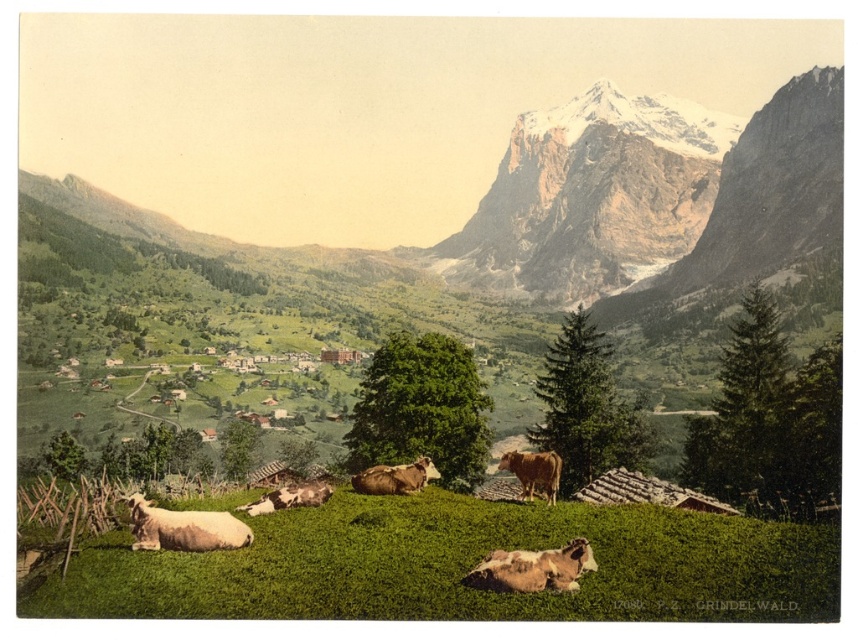
Question: Which of the following is the farthest from the observer?

Choices:
 (A) spotted fur cow at center
 (B) brown furry cow at center
 (C) brown speckled cow at lower center

Answer: (B)

Question: Is white woolly sheep at lower left to the right of brown furry cow at center from the viewer's perspective?

Choices:
 (A) no
 (B) yes

Answer: (A)

Question: Observing the image, what is the correct spatial positioning of rugged stone mountain at center in reference to spotted fur cow at center?

Choices:
 (A) right
 (B) left

Answer: (B)

Question: Which of these objects is positioned closest to the brown speckled cow at lower center?

Choices:
 (A) brown furry cow at center
 (B) brown matte cow at center
 (C) white woolly sheep at lower left

Answer: (B)

Question: Among these objects, which one is farthest from the camera?

Choices:
 (A) white woolly sheep at lower left
 (B) brown furry cow at center
 (C) snowy granite peak at upper center
 (D) rugged stone mountain at center

Answer: (C)

Question: In this image, where is brown speckled cow at lower center located relative to brown furry cow at center?

Choices:
 (A) below
 (B) above

Answer: (A)